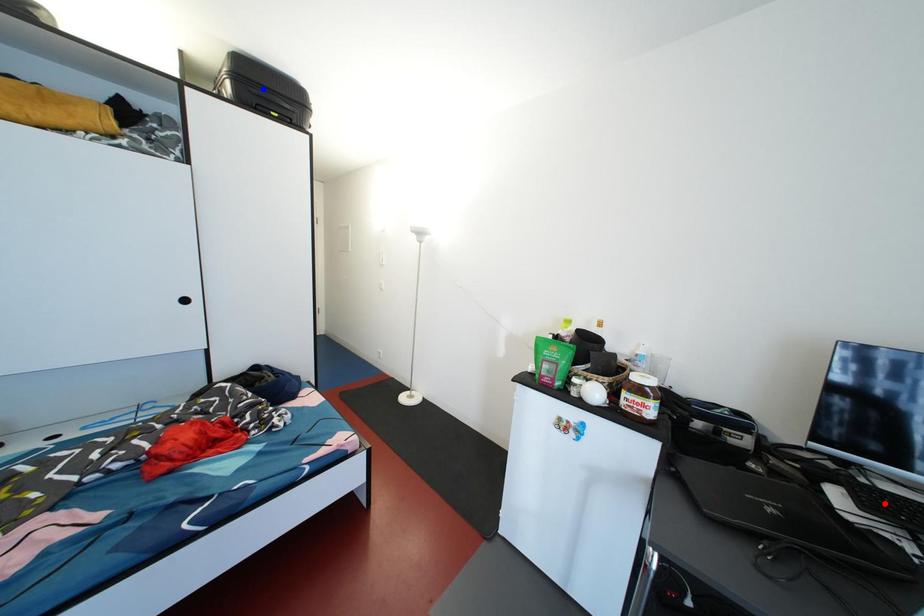
Question: In the image, two points are highlighted. Which point is nearer to the camera? Reply with the corresponding letter.

Choices:
 (A) blue point
 (B) red point

Answer: (B)